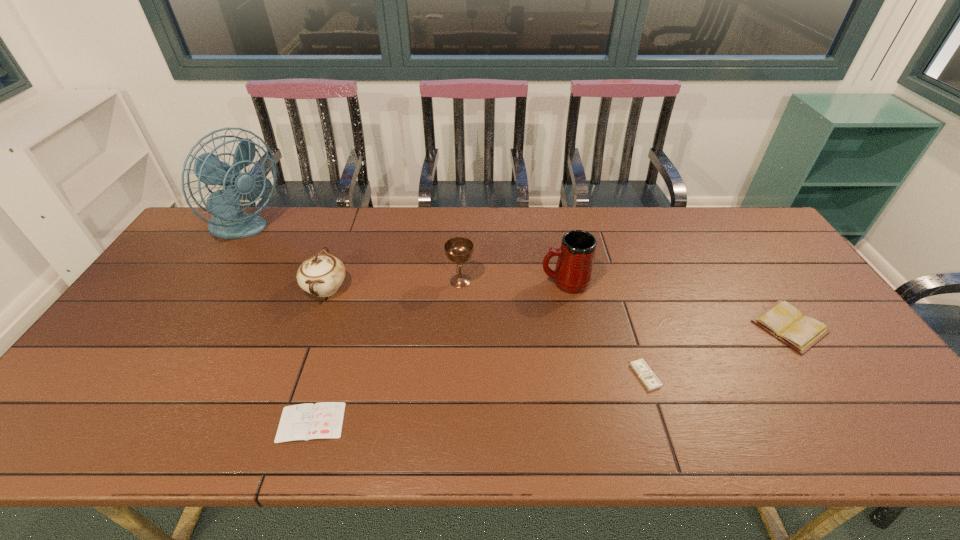
Image resolution: width=960 pixels, height=540 pixels. Identify the location of free space between the left diary and the chalice. (386, 352).

Choose which object is the second nearest neighbor to the fourth object from left to right. Please provide its 2D coordinates. Your answer should be formatted as a tuple, i.e. [(x, y)], where the tuple contains the x and y coordinates of a point satisfying the conditions above.

[(322, 274)]

Point out which object is positioned as the nearest to the mug. Please provide its 2D coordinates. Your answer should be formatted as a tuple, i.e. [(x, y)], where the tuple contains the x and y coordinates of a point satisfying the conditions above.

[(458, 249)]

I want to click on vacant space that satisfies the following two spatial constraints: 1. in front of the fan to blow air; 2. on the right side of the chinaware, so click(x=208, y=289).

The height and width of the screenshot is (540, 960). I want to click on vacant position in the image that satisfies the following two spatial constraints: 1. on the back side of the fourth object from right to left; 2. on the right side of the chinaware, so click(x=328, y=281).

Find the location of a particular element. The height and width of the screenshot is (540, 960). free region that satisfies the following two spatial constraints: 1. on the front side of the rightmost object; 2. on the left side of the chinaware is located at coordinates (312, 327).

At what (x,y) coordinates should I click in order to perform the action: click on free space that satisfies the following two spatial constraints: 1. on the side of the mug with the handle; 2. on the front side of the chinaware. Please return your answer as a coordinate pair (x, y). The image size is (960, 540). Looking at the image, I should click on (566, 289).

Where is `free space that satisfies the following two spatial constraints: 1. on the side of the rightmost object with the handle; 2. on the left side of the sixth shortest object`? The width and height of the screenshot is (960, 540). free space that satisfies the following two spatial constraints: 1. on the side of the rightmost object with the handle; 2. on the left side of the sixth shortest object is located at coordinates (574, 327).

Image resolution: width=960 pixels, height=540 pixels. I want to click on vacant space that satisfies the following two spatial constraints: 1. on the side of the sixth shortest object with the handle; 2. on the right side of the taller diary, so click(574, 327).

The height and width of the screenshot is (540, 960). Identify the location of vacant space that satisfies the following two spatial constraints: 1. in front of the leftmost object to blow air; 2. on the back side of the rightmost object. (184, 327).